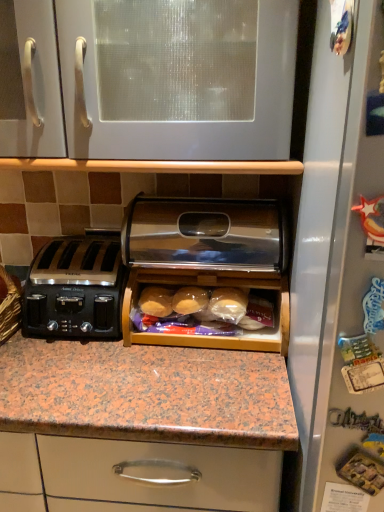
Question: Could you tell me if white glossy cabinet at upper center is turned towards wooden bread box at center?

Choices:
 (A) yes
 (B) no

Answer: (B)

Question: From a real-world perspective, is white glossy cabinet at upper center on wooden bread box at center?

Choices:
 (A) no
 (B) yes

Answer: (B)

Question: Is white glossy cabinet at upper center to the left of wooden bread box at center from the viewer's perspective?

Choices:
 (A) no
 (B) yes

Answer: (B)

Question: Is white glossy cabinet at upper center thinner than wooden bread box at center?

Choices:
 (A) yes
 (B) no

Answer: (B)

Question: Does white glossy cabinet at upper center have a greater height compared to wooden bread box at center?

Choices:
 (A) yes
 (B) no

Answer: (A)

Question: Is white glossy cabinet at upper center not close to wooden bread box at center?

Choices:
 (A) no
 (B) yes

Answer: (A)

Question: Is wooden bread box at center bigger than white glossy cabinet at upper center?

Choices:
 (A) no
 (B) yes

Answer: (A)

Question: From the image's perspective, is wooden bread box at center located beneath white glossy cabinet at upper center?

Choices:
 (A) yes
 (B) no

Answer: (A)

Question: Is wooden bread box at center at the left side of white glossy cabinet at upper center?

Choices:
 (A) yes
 (B) no

Answer: (B)

Question: From the image's perspective, is wooden bread box at center on white glossy cabinet at upper center?

Choices:
 (A) yes
 (B) no

Answer: (B)

Question: Is wooden bread box at center far away from white glossy cabinet at upper center?

Choices:
 (A) no
 (B) yes

Answer: (A)

Question: From a real-world perspective, is wooden bread box at center positioned under white glossy cabinet at upper center based on gravity?

Choices:
 (A) yes
 (B) no

Answer: (A)

Question: Would you say black plastic toaster at left is outside white glossy cabinet at upper center?

Choices:
 (A) no
 (B) yes

Answer: (B)